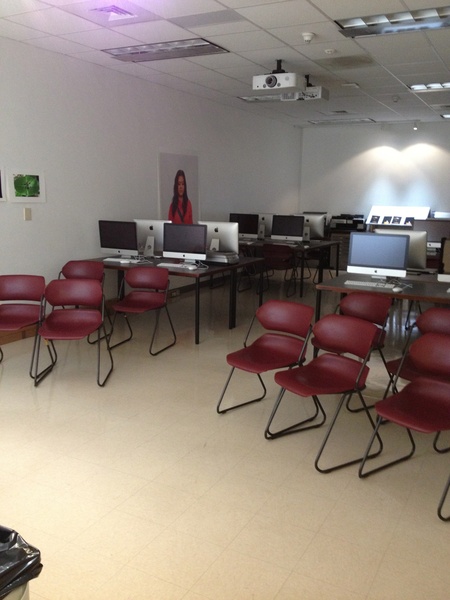
The image size is (450, 600). I want to click on tile, so coord(208,502).